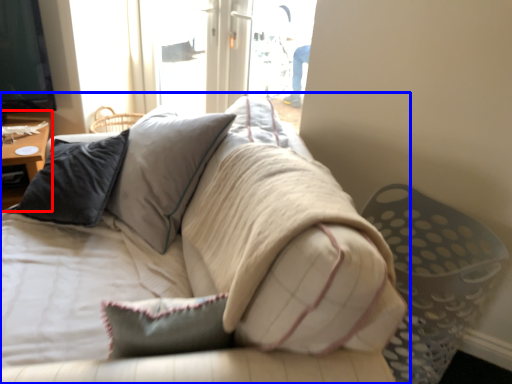
Question: Which of the following is the closest to the observer, table (highlighted by a red box) or studio couch (highlighted by a blue box)?

Choices:
 (A) table
 (B) studio couch

Answer: (B)